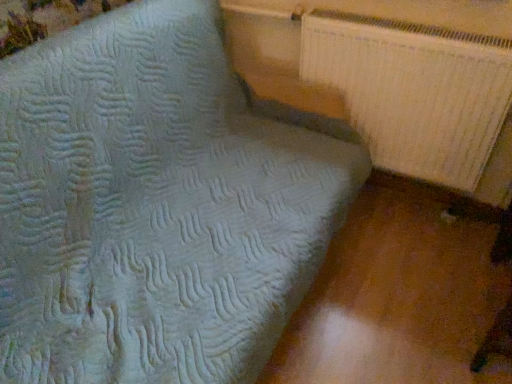
Image resolution: width=512 pixels, height=384 pixels. Find the location of `white textured radiator at upper right`. white textured radiator at upper right is located at coordinates (414, 91).

The width and height of the screenshot is (512, 384). What do you see at coordinates (414, 91) in the screenshot? I see `white textured radiator at upper right` at bounding box center [414, 91].

Locate an element on the screen. white textured radiator at upper right is located at coordinates (414, 91).